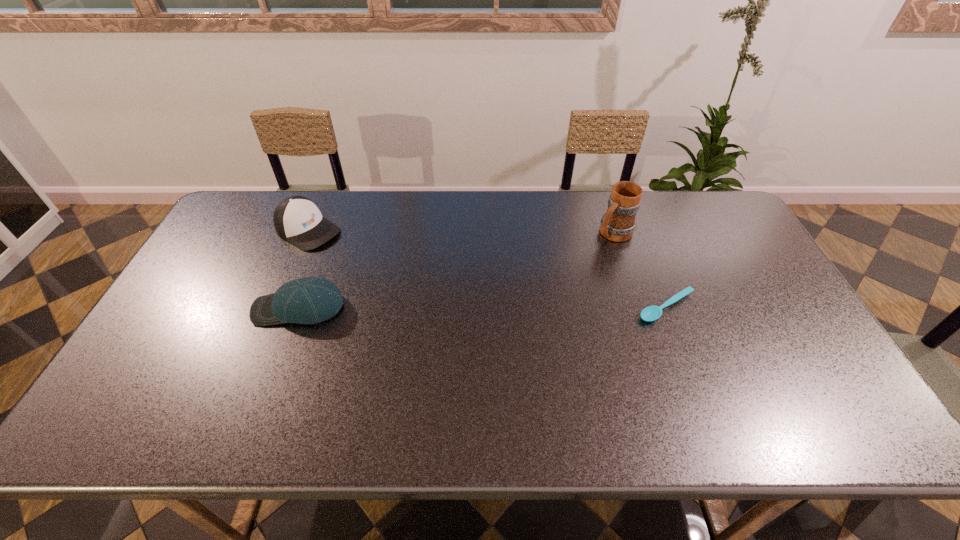
The image size is (960, 540). I want to click on free space between the spoon and the baseball cap, so click(x=483, y=307).

You are a GUI agent. You are given a task and a screenshot of the screen. Output one action in this format:
    pyautogui.click(x=<x>, y=<y>)
    Task: Click on the vacant point located between the tallest object and the cap
    
    Given the screenshot: What is the action you would take?
    pyautogui.click(x=461, y=232)

This screenshot has height=540, width=960. Identify the location of empty location between the shortest object and the second tallest object. (488, 269).

Identify the location of vacant space in between the spoon and the second tallest object. The width and height of the screenshot is (960, 540). (488, 269).

Find the location of a particular element. This screenshot has height=540, width=960. vacant area that lies between the second shortest object and the tallest object is located at coordinates (456, 271).

I want to click on blank region between the shortest object and the tallest object, so click(x=640, y=270).

The height and width of the screenshot is (540, 960). Identify the location of free space between the third tallest object and the cap. pyautogui.click(x=303, y=269).

Locate an element on the screen. The height and width of the screenshot is (540, 960). unoccupied position between the second tallest object and the mug is located at coordinates (461, 232).

You are a GUI agent. You are given a task and a screenshot of the screen. Output one action in this format:
    pyautogui.click(x=<x>, y=<y>)
    Task: Click on the free space between the cap and the shortest object
    
    Given the screenshot: What is the action you would take?
    pyautogui.click(x=488, y=269)

Image resolution: width=960 pixels, height=540 pixels. Find the location of `object that is the second closest to the baseball cap`. object that is the second closest to the baseball cap is located at coordinates (618, 224).